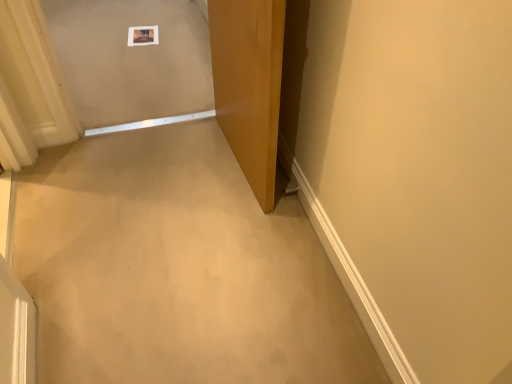
The image size is (512, 384). In order to click on free space in front of wooden door at center in this screenshot , I will do `click(193, 232)`.